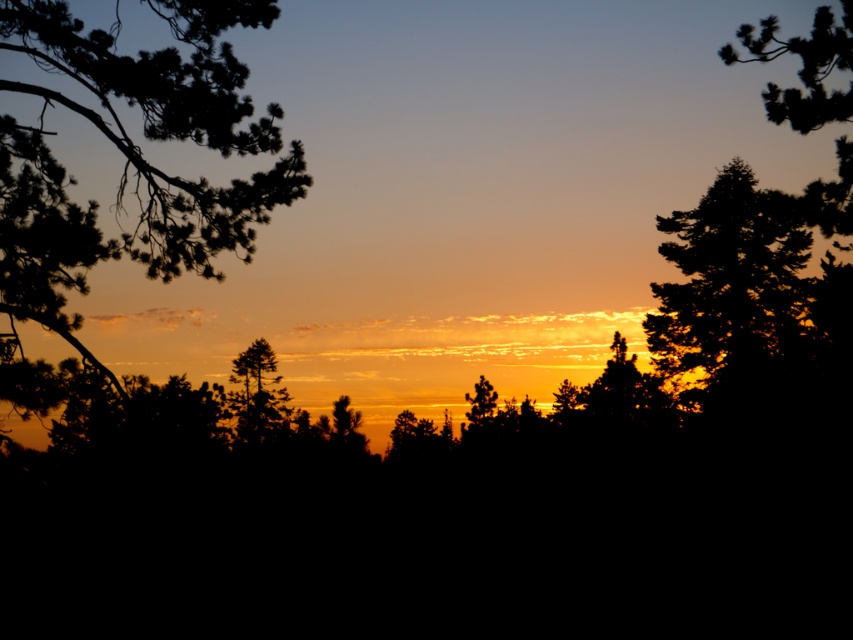
Question: Among these objects, which one is nearest to the camera?

Choices:
 (A) silhouette pine tree at center
 (B) dark green textured pine tree at upper right
 (C) dark green textured tree at right
 (D) silhouette branch at left

Answer: (B)

Question: Observing the image, what is the correct spatial positioning of silhouette branch at left in reference to dark green textured tree at right?

Choices:
 (A) right
 (B) left

Answer: (B)

Question: Which point is farther from the camera taking this photo?

Choices:
 (A) [x=247, y=397]
 (B) [x=746, y=275]
 (C) [x=193, y=125]
 (D) [x=793, y=93]

Answer: (A)

Question: Which point is farther to the camera?

Choices:
 (A) silhouette branch at left
 (B) dark green textured pine tree at upper right

Answer: (A)

Question: Can you confirm if dark green textured pine tree at upper right is wider than silhouette pine tree at center?

Choices:
 (A) yes
 (B) no

Answer: (A)

Question: Does silhouette branch at left appear on the right side of dark green textured tree at right?

Choices:
 (A) no
 (B) yes

Answer: (A)